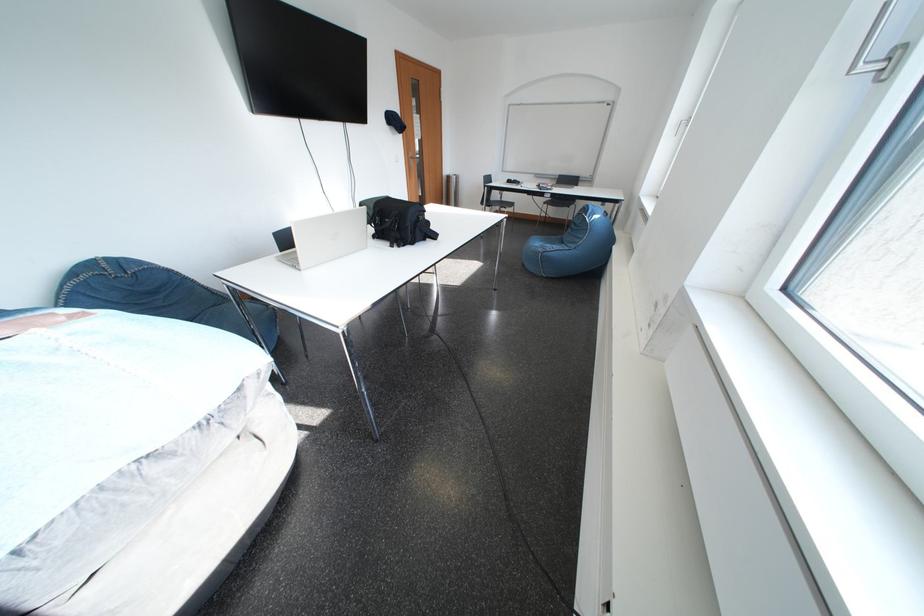
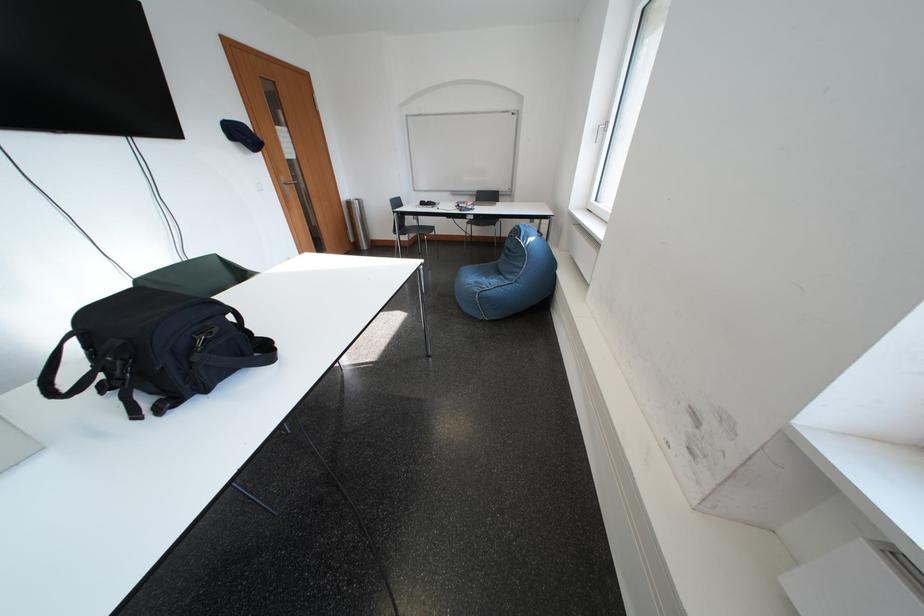
Question: I am providing you with two images of the same scene from different viewpoints. After the viewpoint changes to image2, which objects are now occluded?

Choices:
 (A) closed laptop
 (B) silver trash can
 (C) sofa sitting surface
 (D) none of these

Answer: (D)